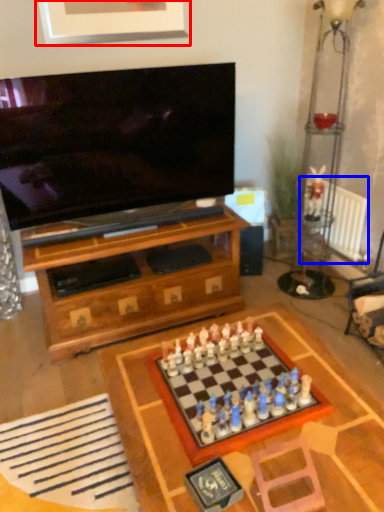
Question: Which object is closer to the camera taking this photo, picture frame (highlighted by a red box) or radiator (highlighted by a blue box)?

Choices:
 (A) picture frame
 (B) radiator

Answer: (A)